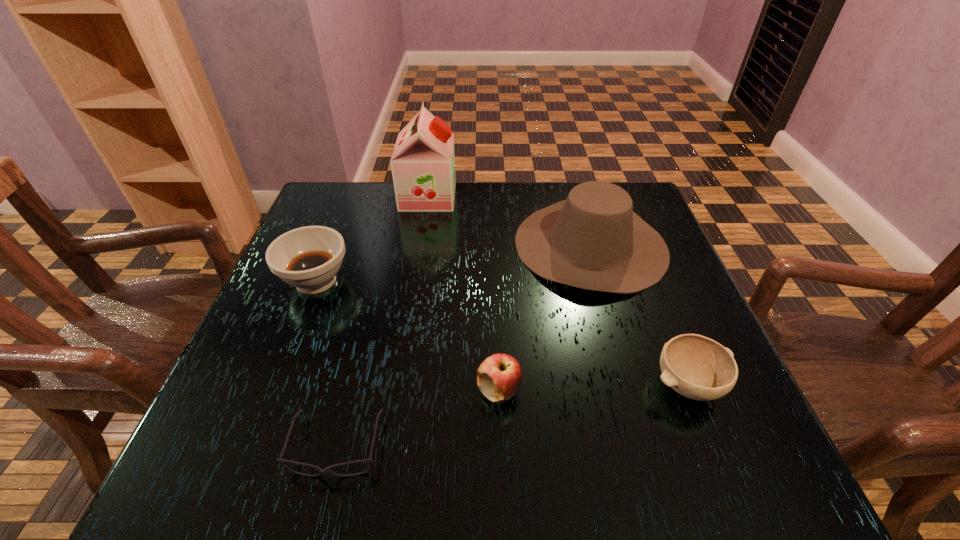
You are a GUI agent. You are given a task and a screenshot of the screen. Output one action in this format:
    pyautogui.click(x=<x>, y=<y>)
    Task: Click on the soya milk
    This screenshot has width=960, height=540.
    Given the screenshot: What is the action you would take?
    pyautogui.click(x=423, y=162)

Image resolution: width=960 pixels, height=540 pixels. What are the coordinates of `cowboy hat` in the screenshot? It's located at (593, 240).

You are a GUI agent. You are given a task and a screenshot of the screen. Output one action in this format:
    pyautogui.click(x=<x>, y=<y>)
    Task: Click on the soup bowl
    The image size is (960, 540).
    Given the screenshot: What is the action you would take?
    pyautogui.click(x=308, y=258)

At what (x,y) coordinates should I click in order to perform the action: click on apple. Please return your answer as a coordinate pair (x, y). Looking at the image, I should click on (x=499, y=377).

The width and height of the screenshot is (960, 540). I want to click on bowl, so click(x=699, y=368).

Identify the location of the shortest object. The width and height of the screenshot is (960, 540). (327, 470).

Find the location of a particular element. This screenshot has width=960, height=540. spectacles is located at coordinates click(327, 470).

The height and width of the screenshot is (540, 960). I want to click on vacant region located with the cap open on the soya milk, so click(x=555, y=196).

At what (x,y) coordinates should I click in order to perform the action: click on vacant space located on the left of the cowboy hat. Please return your answer as a coordinate pair (x, y). The width and height of the screenshot is (960, 540). Looking at the image, I should click on (454, 245).

In order to click on vacant space situated 0.070m on the right of the soup bowl in this screenshot , I will do `click(383, 281)`.